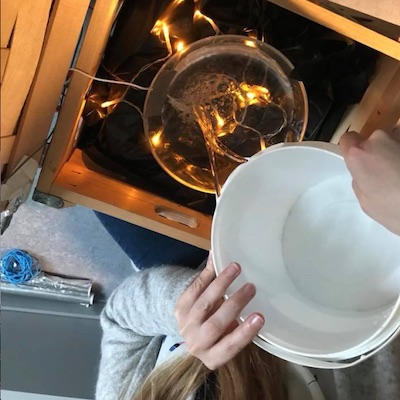
Image resolution: width=400 pixels, height=400 pixels. In order to click on glass bowl in this screenshot , I will do `click(230, 112)`.